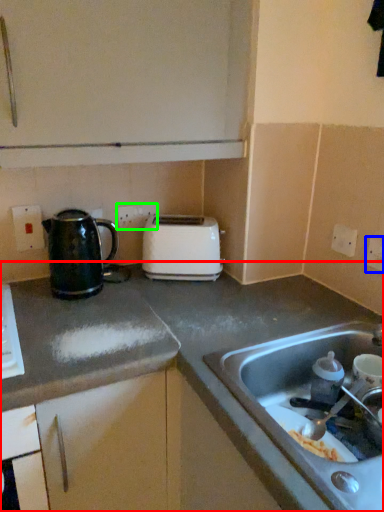
Question: Which is nearer to the countertop (highlighted by a red box)? electric outlet (highlighted by a blue box) or electric outlet (highlighted by a green box).

Choices:
 (A) electric outlet
 (B) electric outlet

Answer: (B)